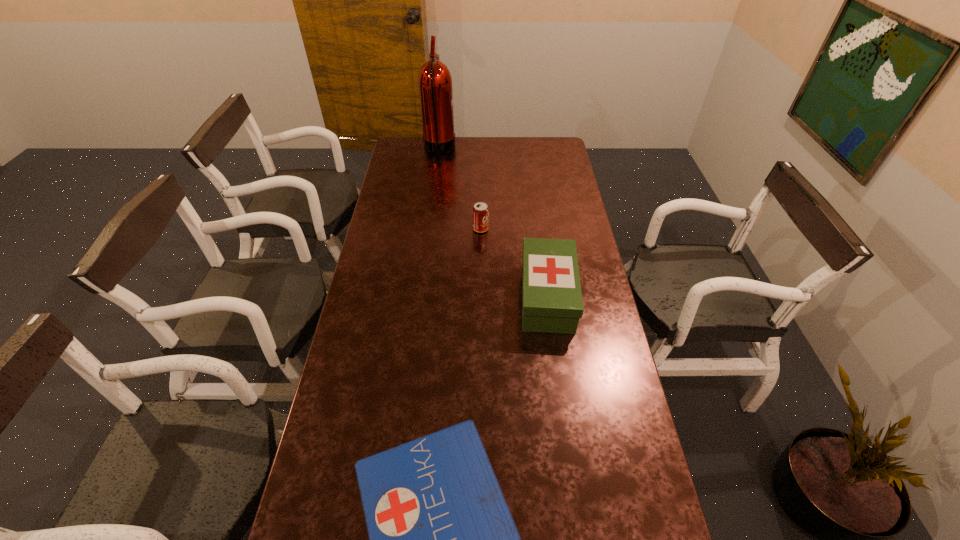
This screenshot has width=960, height=540. I want to click on the farthest object, so click(435, 86).

What are the coordinates of `fire extinguisher` in the screenshot? It's located at (435, 86).

Locate an element on the screen. The width and height of the screenshot is (960, 540). the third farthest object is located at coordinates (552, 302).

Identify the location of the farther first-aid kit. Image resolution: width=960 pixels, height=540 pixels. (552, 302).

Where is `soda can`? The height and width of the screenshot is (540, 960). soda can is located at coordinates (480, 210).

You are a GUI agent. You are given a task and a screenshot of the screen. Output one action in this format:
    pyautogui.click(x=<x>, y=<y>)
    Task: Click on the free spot located 0.330m on the front-facing side of the farthest object
    
    Given the screenshot: What is the action you would take?
    pyautogui.click(x=521, y=149)

This screenshot has width=960, height=540. I want to click on blank area located on the back of the rightmost object, so click(x=540, y=240).

You are a GUI agent. You are given a task and a screenshot of the screen. Output one action in this format:
    pyautogui.click(x=<x>, y=<y>)
    Task: Click on the vacant space located on the right of the third nearest object
    Image resolution: width=960 pixels, height=540 pixels.
    Given the screenshot: What is the action you would take?
    pyautogui.click(x=553, y=229)

Locate an element on the screen. object at the far edge is located at coordinates (x=435, y=86).

Find the location of a particular element. The width and height of the screenshot is (960, 540). object that is at the left edge is located at coordinates (435, 86).